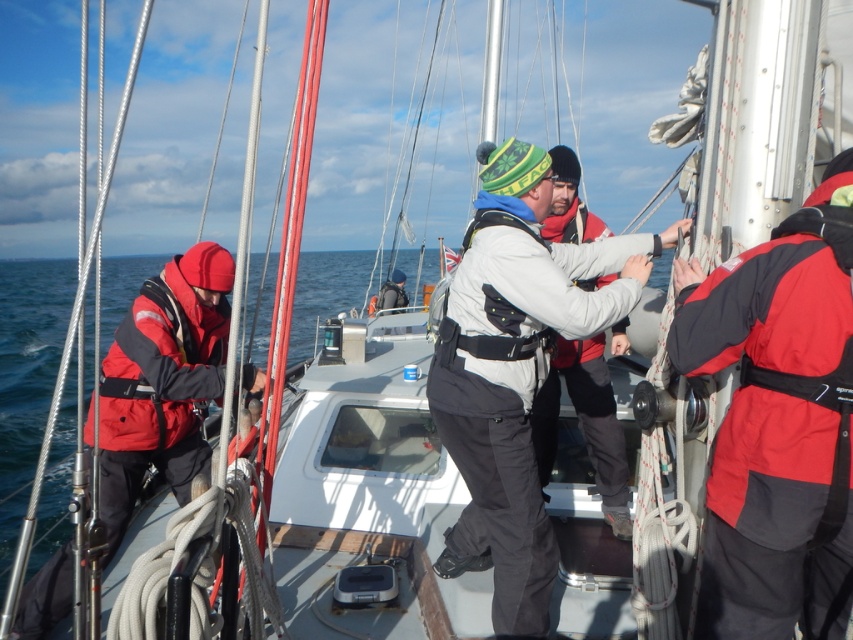
You are a photographer on the sailboat and want to take a photo of the gray synthetic life jacket at center without the white fleece jacket at center blocking it. What should you do?

Move the white fleece jacket at center behind the gray synthetic life jacket at center so that the gray synthetic life jacket at center is in front.

You are a photographer on the sailboat and want to take a photo of both the white fleece jacket at center and the red softshell jacket at left. Since you can only focus on one subject at a time, which jacket should you focus on to ensure the other remains in the background?

You should focus on the white fleece jacket at center because it is closer to the viewer than the red softshell jacket at left, which will naturally stay in the background when the closer jacket is in focus.

You are standing on the deck of the sailboat and notice the point marked at coordinates (515, 369). What object is located at that point?

The white fleece jacket at center is located at the point marked at coordinates (515, 369).